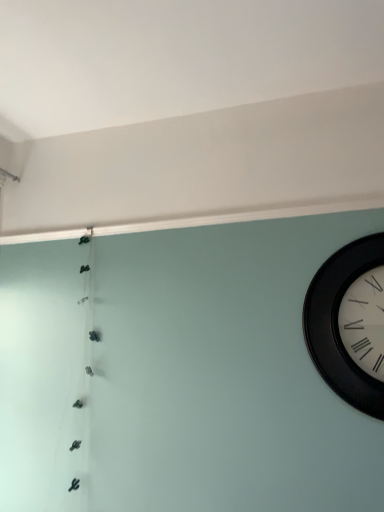
Looking at this image, in order to face black plastic wall clock at upper right, should I rotate leftwards or rightwards?

Rotate right and turn 20.600 degrees.

Image resolution: width=384 pixels, height=512 pixels. What do you see at coordinates (350, 323) in the screenshot?
I see `black plastic wall clock at upper right` at bounding box center [350, 323].

Measure the distance between point (343, 273) and camera.

The distance of point (343, 273) from camera is 5.74 feet.

Locate an element on the screen. The height and width of the screenshot is (512, 384). black plastic wall clock at upper right is located at coordinates (350, 323).

Where is `black plastic wall clock at upper right`? This screenshot has width=384, height=512. black plastic wall clock at upper right is located at coordinates (350, 323).